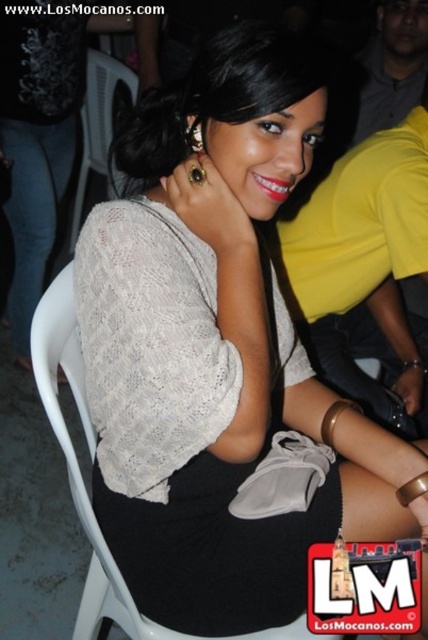
Question: Which of the following is the closest to the observer?

Choices:
 (A) white plastic chair at center
 (B) white plastic chair at upper left

Answer: (A)

Question: Among these points, which one is nearest to the camera?

Choices:
 (A) (86, 172)
 (B) (92, 451)

Answer: (B)

Question: Can you confirm if white plastic chair at center is positioned to the right of white plastic chair at upper left?

Choices:
 (A) yes
 (B) no

Answer: (A)

Question: Does white plastic chair at center have a larger size compared to white plastic chair at upper left?

Choices:
 (A) yes
 (B) no

Answer: (B)

Question: Which point appears farthest from the camera in this image?

Choices:
 (A) (50, 353)
 (B) (98, 58)

Answer: (B)

Question: Considering the relative positions of white plastic chair at center and white plastic chair at upper left in the image provided, where is white plastic chair at center located with respect to white plastic chair at upper left?

Choices:
 (A) left
 (B) right

Answer: (B)